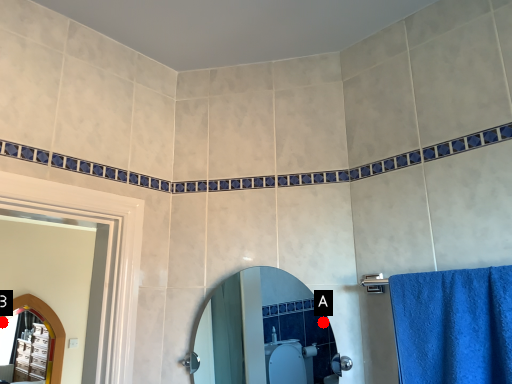
Question: Two points are circled on the image, labeled by A and B beside each circle. Which point is closer to the camera?

Choices:
 (A) A is closer
 (B) B is closer

Answer: (B)